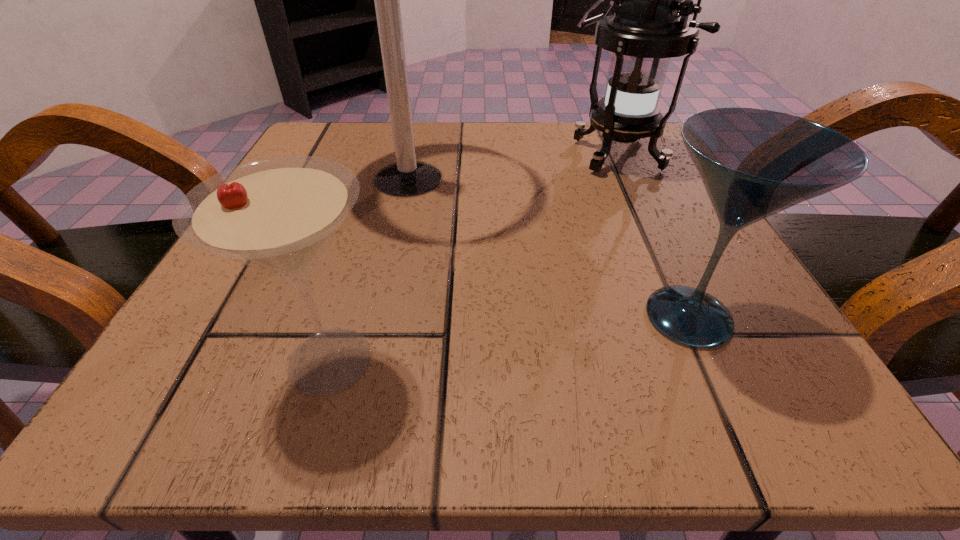
In order to click on blank region between the right martini and the left martini in this screenshot , I will do `click(509, 339)`.

I want to click on unoccupied position between the right martini and the table lamp, so click(x=548, y=248).

Identify the location of vacant area that lies between the left martini and the right martini. This screenshot has width=960, height=540. (509, 339).

You are a GUI agent. You are given a task and a screenshot of the screen. Output one action in this format:
    pyautogui.click(x=<x>, y=<y>)
    Task: Click on the free space between the second tallest object and the right martini
    This screenshot has height=540, width=960.
    Given the screenshot: What is the action you would take?
    pyautogui.click(x=650, y=235)

In order to click on object that ranks as the second closest to the left martini in this screenshot , I will do `click(754, 163)`.

Identify which object is the third nearest to the right martini. Please provide its 2D coordinates. Your answer should be formatted as a tuple, i.e. [(x, y)], where the tuple contains the x and y coordinates of a point satisfying the conditions above.

[(278, 214)]

What are the coordinates of `free space that satisfies the following two spatial constraints: 1. on the back side of the right martini; 2. on the right side of the left martini` in the screenshot? It's located at (343, 317).